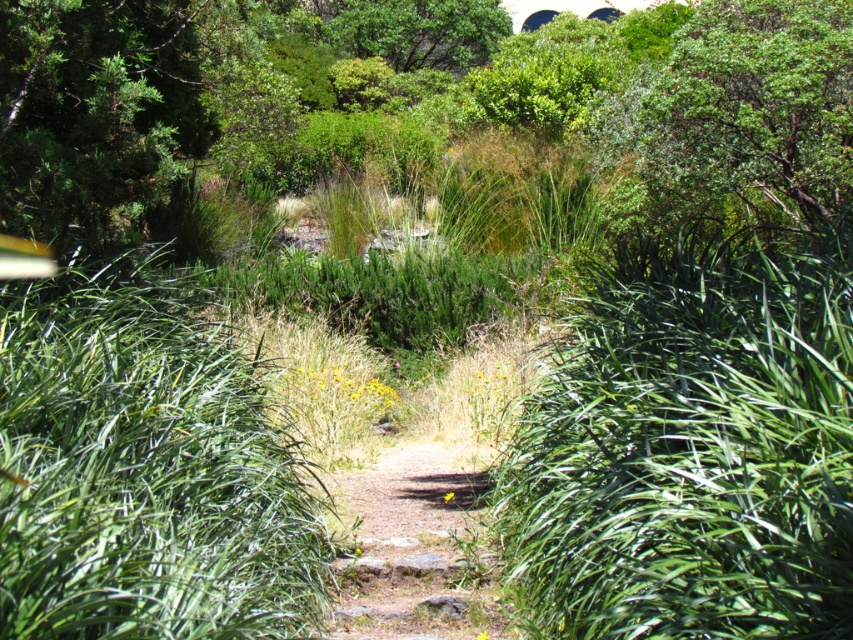
You are a hiker trying to follow the dirt path at center in the garden. There is a green leafy tree at upper right nearby. Which direction should you turn to reach the tree from the path?

To reach the green leafy tree at upper right from the dirt path at center, you should turn to your right since the green leafy tree at upper right is located to the right of the dirt path at center.

You are a hiker who wants to take a photo of the green leafy tree at upper right. You are currently standing at the green leafy bush at center. Which direction should you move to get a better view of the tree?

Since the green leafy bush at center is shorter than the green leafy tree at upper right, you should move to a higher elevation or position yourself further away from the bush to ensure the tree is fully visible without obstruction.

You are a hiker trying to follow the dirt path at center in the garden. There is a green leafy bush at center blocking your way. Which direction should you go to avoid it?

The green leafy bush at center is positioned on the right side of dirt path at center, so you should go to the left side of the dirt path at center to avoid it.